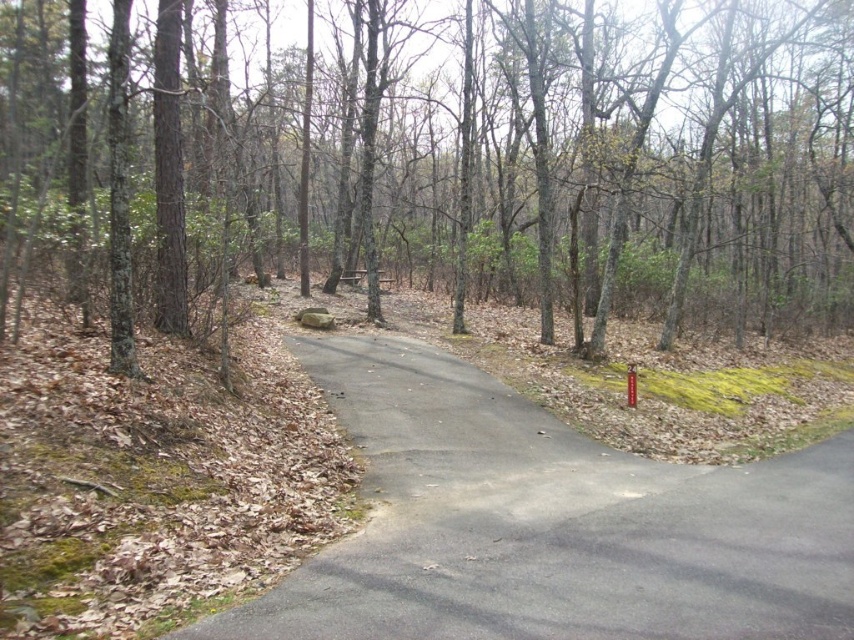
Question: Among these points, which one is nearest to the camera?

Choices:
 (A) (781, 480)
 (B) (600, 49)

Answer: (A)

Question: From the image, what is the correct spatial relationship of brown bark tree at center in relation to gray asphalt road at center?

Choices:
 (A) right
 (B) left

Answer: (B)

Question: Is brown bark tree at center wider than gray asphalt road at center?

Choices:
 (A) no
 (B) yes

Answer: (B)

Question: Observing the image, what is the correct spatial positioning of brown bark tree at center in reference to gray asphalt road at center?

Choices:
 (A) left
 (B) right

Answer: (A)